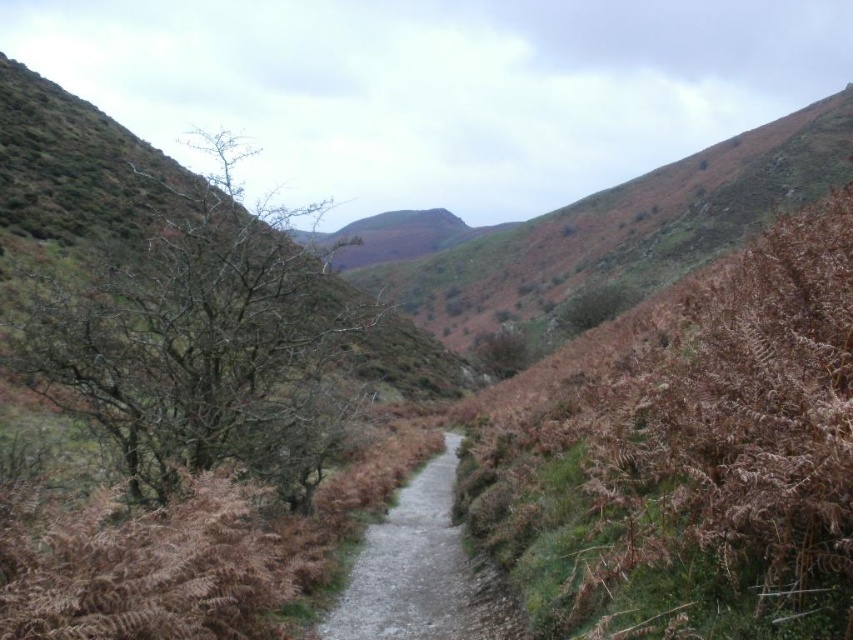
Question: Does bare branches at left lie behind dirt/gravel path at center?

Choices:
 (A) yes
 (B) no

Answer: (B)

Question: Can you confirm if bare branches at left is positioned to the right of dirt/gravel path at center?

Choices:
 (A) yes
 (B) no

Answer: (B)

Question: Is bare branches at left to the right of dirt/gravel path at center from the viewer's perspective?

Choices:
 (A) no
 (B) yes

Answer: (A)

Question: Which object appears farthest from the camera in this image?

Choices:
 (A) bare branches at left
 (B) dirt/gravel path at center

Answer: (B)

Question: Which point appears closest to the camera in this image?

Choices:
 (A) (138, 294)
 (B) (408, 512)

Answer: (A)